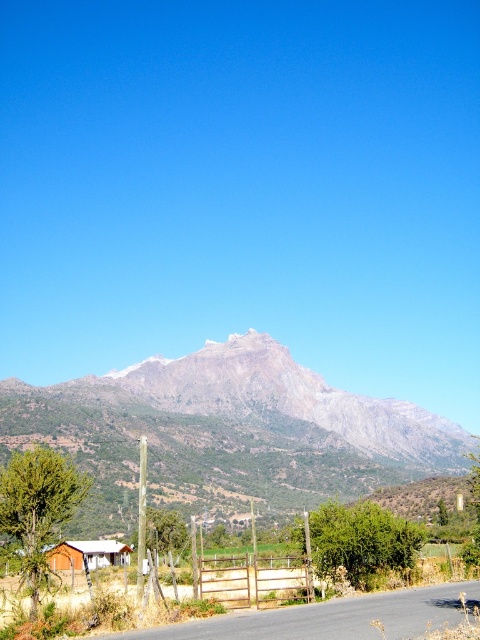
Question: Among these points, which one is farthest from the camera?

Choices:
 (A) (372, 460)
 (B) (62, 548)

Answer: (A)

Question: Does gray rocky mountain range at upper center appear over wooden cabin at lower left?

Choices:
 (A) no
 (B) yes

Answer: (A)

Question: Does gray rocky mountain range at upper center appear on the right side of wooden cabin at lower left?

Choices:
 (A) no
 (B) yes

Answer: (B)

Question: Can you confirm if gray rocky mountain range at upper center is bigger than wooden cabin at lower left?

Choices:
 (A) no
 (B) yes

Answer: (B)

Question: Which point is farther from the camera taking this photo?

Choices:
 (A) (87, 545)
 (B) (112, 433)

Answer: (B)